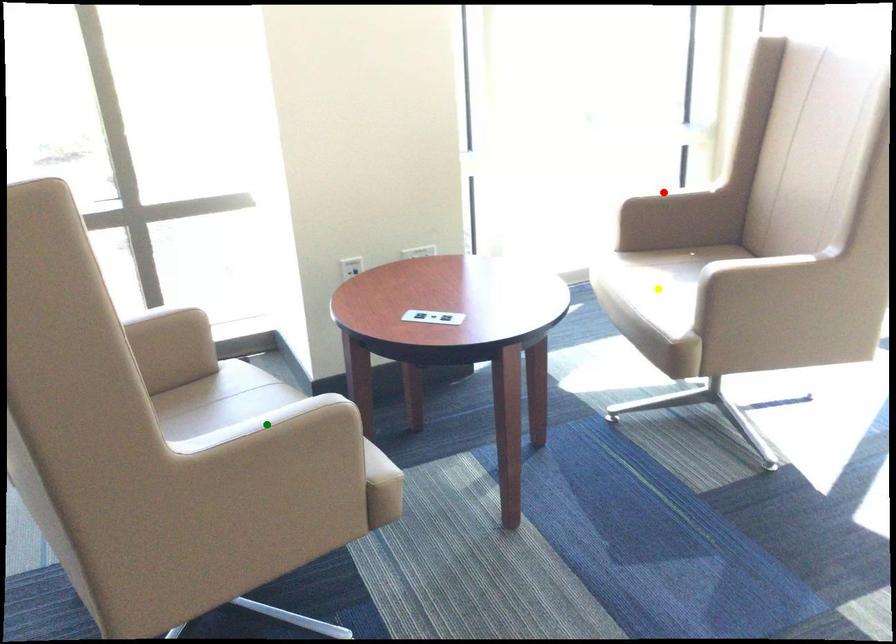
Order these from farthest to nearest:
green point | red point | yellow point

red point < yellow point < green point